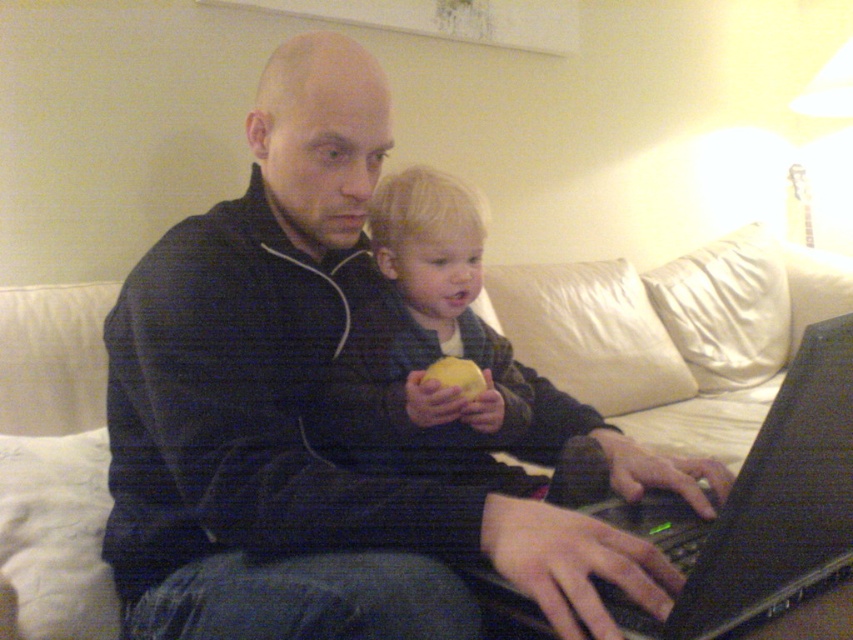
Question: Can you confirm if black plastic laptop at center is wider than yellow matte apple at center?

Choices:
 (A) yes
 (B) no

Answer: (A)

Question: Estimate the real-world distances between objects in this image. Which object is closer to the yellow matte apple at center?

Choices:
 (A) black plastic laptop at center
 (B) black matte jacket at center

Answer: (B)

Question: Can you confirm if black matte jacket at center is positioned below black plastic laptop at center?

Choices:
 (A) yes
 (B) no

Answer: (B)

Question: Which object is the farthest from the black plastic laptop at center?

Choices:
 (A) black matte jacket at center
 (B) yellow matte apple at center

Answer: (B)

Question: Among these points, which one is nearest to the camera?

Choices:
 (A) (440, 376)
 (B) (606, 592)
 (C) (183, 488)

Answer: (B)

Question: Can you confirm if black matte jacket at center is positioned above yellow matte apple at center?

Choices:
 (A) no
 (B) yes

Answer: (B)